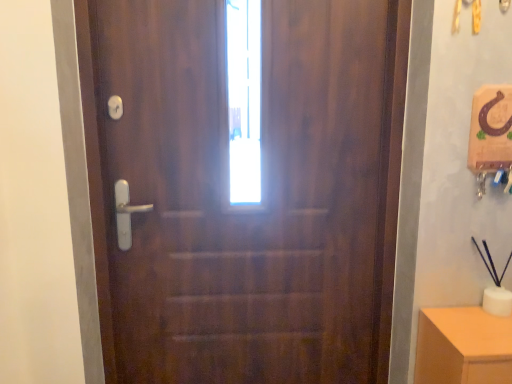
This screenshot has width=512, height=384. Describe the element at coordinates (246, 187) in the screenshot. I see `wooden door at center` at that location.

Measure the distance between point (359, 163) and camera.

Point (359, 163) and camera are 1.44 meters apart from each other.

Locate an element on the screen. Image resolution: width=512 pixels, height=384 pixels. wooden door at center is located at coordinates (246, 187).

Locate an element on the screen. This screenshot has height=384, width=512. wooden door at center is located at coordinates (246, 187).